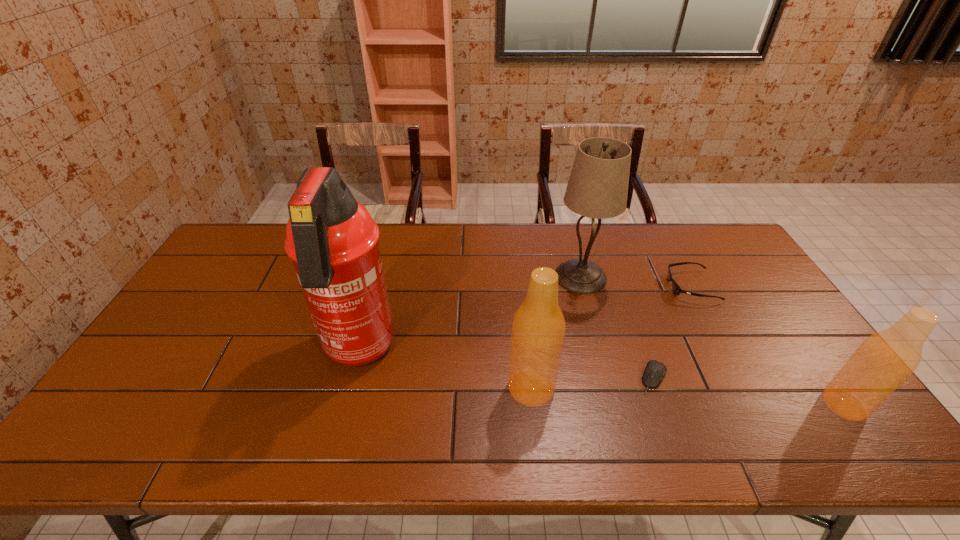
Where is `empty space between the rightmost object and the fire extinguisher`? empty space between the rightmost object and the fire extinguisher is located at coordinates (601, 378).

This screenshot has width=960, height=540. Identify the location of free space between the lampshade and the fourth tallest object. (712, 341).

The width and height of the screenshot is (960, 540). I want to click on empty space that is in between the sunglasses and the computer mouse, so click(672, 332).

This screenshot has height=540, width=960. I want to click on free space between the shortest object and the leftmost object, so click(x=506, y=364).

At what (x,y) coordinates should I click in order to perform the action: click on free area in between the second object from right to left and the third shortest object. Please return your answer as a coordinate pair (x, y). This screenshot has width=960, height=540. Looking at the image, I should click on (768, 345).

The width and height of the screenshot is (960, 540). What are the coordinates of `vacant area between the lampshade and the computer mouse` in the screenshot? It's located at (617, 327).

You are a GUI agent. You are given a task and a screenshot of the screen. Output one action in this format:
    pyautogui.click(x=<x>, y=<y>)
    Task: Click on the empty space that is in between the fifth object from left to right and the left beer bottle
    
    Given the screenshot: What is the action you would take?
    pyautogui.click(x=612, y=337)

Locate an element on the screen. free space between the lampshade and the third shortest object is located at coordinates (712, 341).

At what (x,y) coordinates should I click in order to perform the action: click on vacant space that's between the computer mouse and the fourth shortest object. Please return your answer as a coordinate pair (x, y). This screenshot has width=960, height=540. Looking at the image, I should click on (592, 383).

Identify which object is the fourth closest to the third tallest object. Please provide its 2D coordinates. Your answer should be formatted as a tuple, i.e. [(x, y)], where the tuple contains the x and y coordinates of a point satisfying the conditions above.

[(677, 290)]